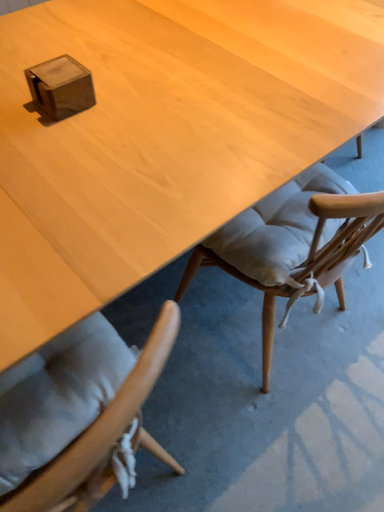
Question: From a real-world perspective, does wooden cube at upper left sit lower than light wood desk at center?

Choices:
 (A) yes
 (B) no

Answer: (B)

Question: Is wooden cube at upper left to the left of light wood desk at center from the viewer's perspective?

Choices:
 (A) yes
 (B) no

Answer: (A)

Question: Is wooden cube at upper left surrounding light wood desk at center?

Choices:
 (A) no
 (B) yes

Answer: (A)

Question: Is wooden cube at upper left beside light wood desk at center?

Choices:
 (A) no
 (B) yes

Answer: (A)

Question: From a real-world perspective, is wooden cube at upper left on light wood desk at center?

Choices:
 (A) no
 (B) yes

Answer: (B)

Question: Could you tell me if wooden cube at upper left is facing light wood desk at center?

Choices:
 (A) no
 (B) yes

Answer: (A)

Question: Is light wood desk at center bigger than wooden cube at upper left?

Choices:
 (A) no
 (B) yes

Answer: (B)

Question: Is light wood desk at center closer to camera compared to wooden cube at upper left?

Choices:
 (A) no
 (B) yes

Answer: (B)

Question: Does light wood desk at center appear on the right side of wooden cube at upper left?

Choices:
 (A) yes
 (B) no

Answer: (A)

Question: Is light wood desk at center shorter than wooden cube at upper left?

Choices:
 (A) yes
 (B) no

Answer: (B)

Question: Is light wood desk at center smaller than wooden cube at upper left?

Choices:
 (A) no
 (B) yes

Answer: (A)

Question: Is light wood desk at center far away from wooden cube at upper left?

Choices:
 (A) yes
 (B) no

Answer: (B)

Question: Does point (269, 53) appear closer or farther from the camera than point (77, 97)?

Choices:
 (A) farther
 (B) closer

Answer: (A)